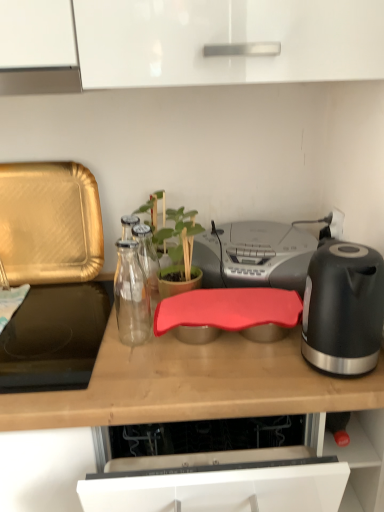
Question: Is gold textured tray at left surrounding rubberized red cutting board at center?

Choices:
 (A) no
 (B) yes

Answer: (A)

Question: Is gold textured tray at left wider than rubberized red cutting board at center?

Choices:
 (A) yes
 (B) no

Answer: (B)

Question: Is gold textured tray at left with rubberized red cutting board at center?

Choices:
 (A) yes
 (B) no

Answer: (B)

Question: Considering the relative sizes of gold textured tray at left and rubberized red cutting board at center in the image provided, is gold textured tray at left thinner than rubberized red cutting board at center?

Choices:
 (A) yes
 (B) no

Answer: (A)

Question: Is gold textured tray at left further to camera compared to rubberized red cutting board at center?

Choices:
 (A) no
 (B) yes

Answer: (B)

Question: Does point (379, 339) appear closer or farther from the camera than point (56, 332)?

Choices:
 (A) closer
 (B) farther

Answer: (A)

Question: Considering their positions, is black matte electric kettle at right located in front of or behind black glass cooktop at left?

Choices:
 (A) front
 (B) behind

Answer: (A)

Question: Considering the relative positions of black matte electric kettle at right and black glass cooktop at left in the image provided, is black matte electric kettle at right to the left or to the right of black glass cooktop at left?

Choices:
 (A) left
 (B) right

Answer: (B)

Question: From a real-world perspective, is black matte electric kettle at right physically located above or below black glass cooktop at left?

Choices:
 (A) above
 (B) below

Answer: (A)

Question: Considering their positions, is black matte electric kettle at right located in front of or behind gray plastic stereo at center?

Choices:
 (A) front
 (B) behind

Answer: (A)

Question: Is black matte electric kettle at right inside or outside of gray plastic stereo at center?

Choices:
 (A) inside
 (B) outside

Answer: (B)

Question: Considering the relative positions of black matte electric kettle at right and gray plastic stereo at center in the image provided, is black matte electric kettle at right to the left or to the right of gray plastic stereo at center?

Choices:
 (A) right
 (B) left

Answer: (A)

Question: Considering the positions of black matte electric kettle at right and gray plastic stereo at center in the image, is black matte electric kettle at right bigger or smaller than gray plastic stereo at center?

Choices:
 (A) big
 (B) small

Answer: (B)

Question: Considering the positions of black matte electric kettle at right and green matte plant at center in the image, is black matte electric kettle at right taller or shorter than green matte plant at center?

Choices:
 (A) short
 (B) tall

Answer: (A)

Question: Considering their positions, is black matte electric kettle at right located in front of or behind green matte plant at center?

Choices:
 (A) front
 (B) behind

Answer: (A)